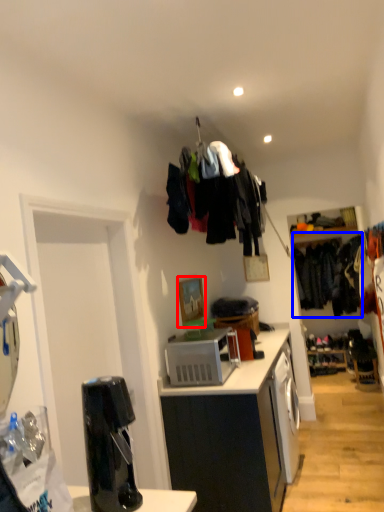
Question: Which of the following is the farthest to the observer, picture frame (highlighted by a red box) or clothing (highlighted by a blue box)?

Choices:
 (A) picture frame
 (B) clothing

Answer: (B)